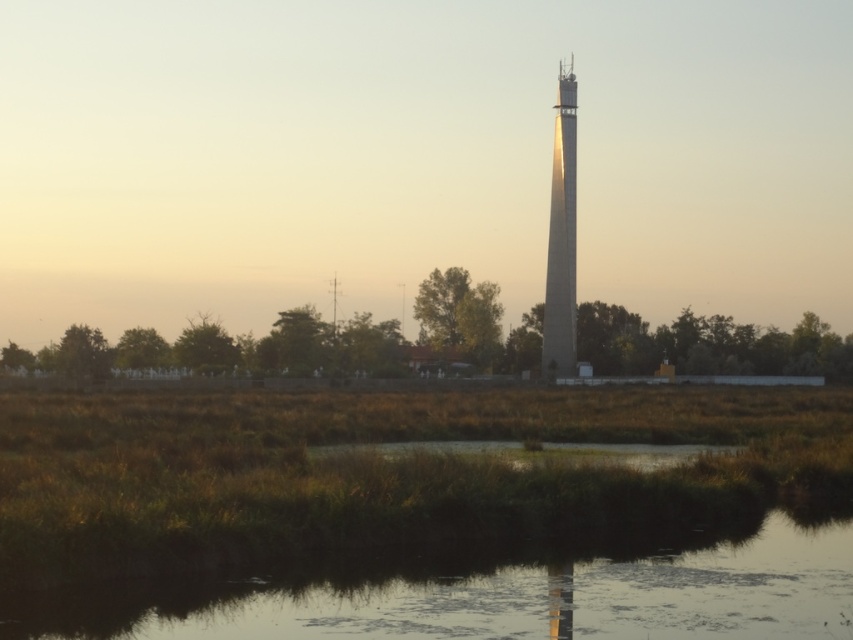
Consider the image. You are a photographer planning to capture the smooth concrete tower at center in your shot. You notice the transparent water at lower center might block the view. Can you confirm if the tower is taller than the water?

The transparent water at lower center is not as tall as smooth concrete tower at center, so yes, the smooth concrete tower at center is taller than the transparent water at lower center and will not be fully blocked.

You are standing at the edge of the transparent water at lower center and want to walk directly towards the smooth concrete tower at center. Which direction should you head?

Since the transparent water at lower center is closer to the viewer than the smooth concrete tower at center, you should head forward towards the center of the image to reach the smooth concrete tower at center.